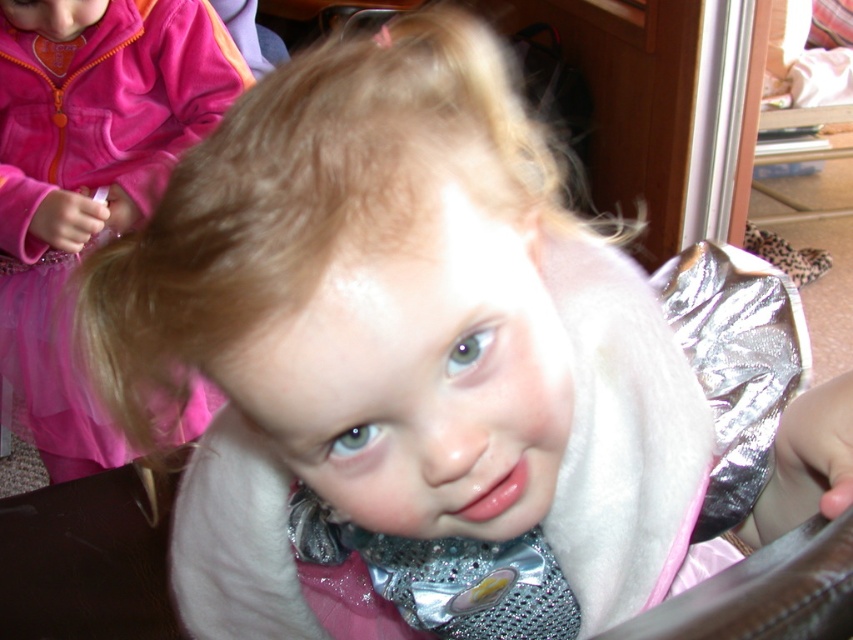
Where is the matte pink dress at upper left located in the image?

The matte pink dress at upper left is located at point (x=88, y=177).

You are a photographer adjusting the lighting for a photo shoot. You notice a point at coordinates [88,177] in the image. Based on the scene description, what object is located at that point?

The point at coordinates [88,177] corresponds to the matte pink dress at upper left.

You are a photographer trying to adjust the lighting for a photo shoot. You notice the matte pink dress at upper left and the silver reflective foil at center. Which object is located more to the left side of the image?

The matte pink dress at upper left is positioned on the left side of the silver reflective foil at center, so it is more to the left.